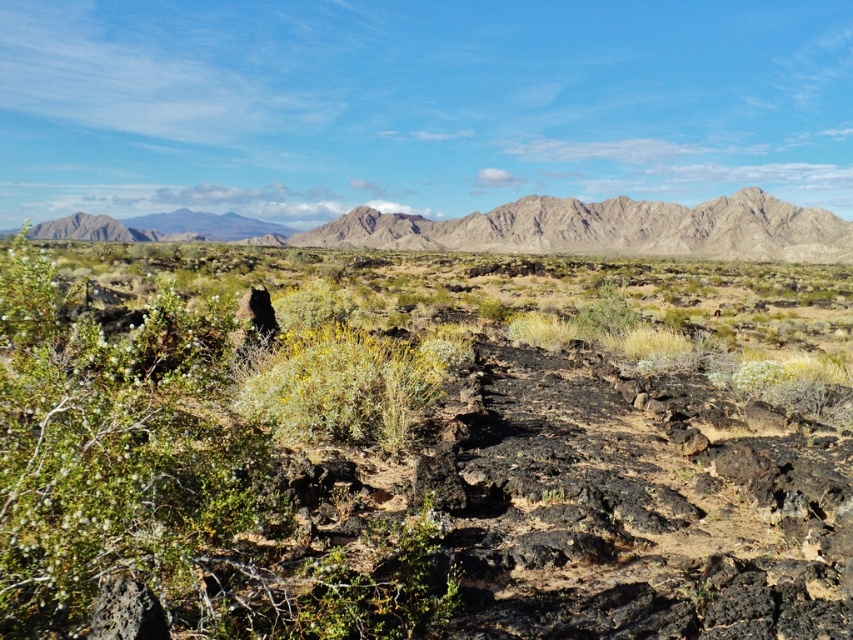
Is volcanic rock at center to the left of rugged rock mountain at center from the viewer's perspective?

Correct, you'll find volcanic rock at center to the left of rugged rock mountain at center.

Is volcanic rock at center positioned at the back of rugged rock mountain at center?

That is False.

Is point (584, 456) more distant than point (416, 230)?

No, it is in front of (416, 230).

Find the location of a particular element. The width and height of the screenshot is (853, 640). volcanic rock at center is located at coordinates (399, 465).